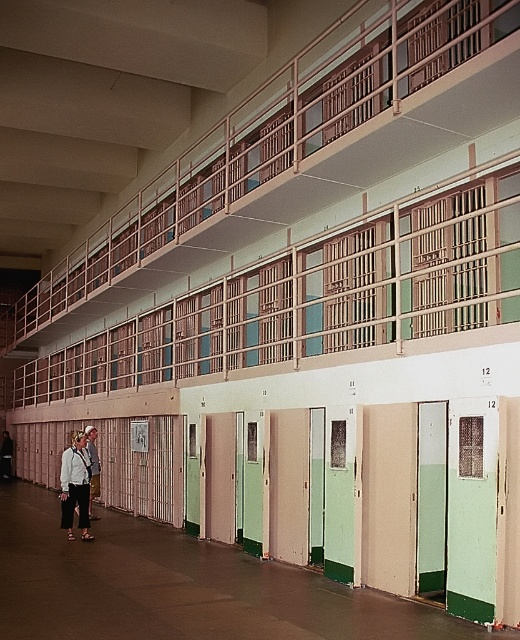
Who is higher up, white cotton shirt at lower left or light brown leather jacket at lower left?

Positioned higher is light brown leather jacket at lower left.

Does white cotton shirt at lower left appear on the right side of light brown leather jacket at lower left?

Correct, you'll find white cotton shirt at lower left to the right of light brown leather jacket at lower left.

Where is `white cotton shirt at lower left`? white cotton shirt at lower left is located at coordinates (75, 486).